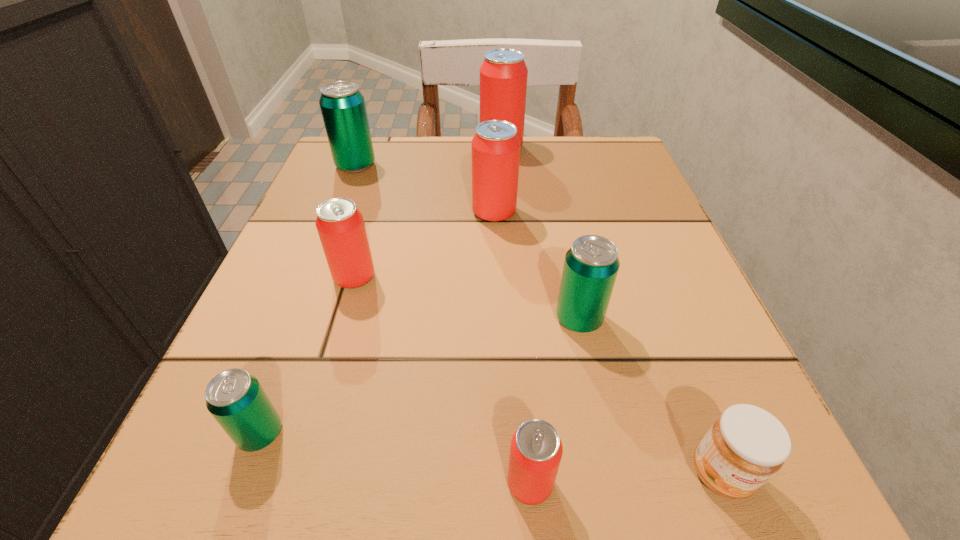
Identify the location of the farthest red beer can. The height and width of the screenshot is (540, 960). (503, 74).

Identify the location of the biggest red beer can. The height and width of the screenshot is (540, 960). tap(503, 74).

This screenshot has width=960, height=540. Identify the location of the farthest teal beer can. (342, 105).

The width and height of the screenshot is (960, 540). I want to click on the second farthest red beer can, so click(495, 146).

Identify the location of the third smallest red beer can. This screenshot has width=960, height=540. (495, 146).

At what (x,y) coordinates should I click in order to perform the action: click on the second nearest red beer can. Please return your answer as a coordinate pair (x, y). Looking at the image, I should click on (340, 225).

Find the location of `the leftmost red beer can`. the leftmost red beer can is located at coordinates (340, 225).

Locate an element on the screen. The width and height of the screenshot is (960, 540). the fourth nearest object is located at coordinates (591, 265).

Where is `the rightmost teal beer can`? Image resolution: width=960 pixels, height=540 pixels. the rightmost teal beer can is located at coordinates coord(591,265).

Locate an element on the screen. The width and height of the screenshot is (960, 540). the sixth farthest beer can is located at coordinates (235, 398).